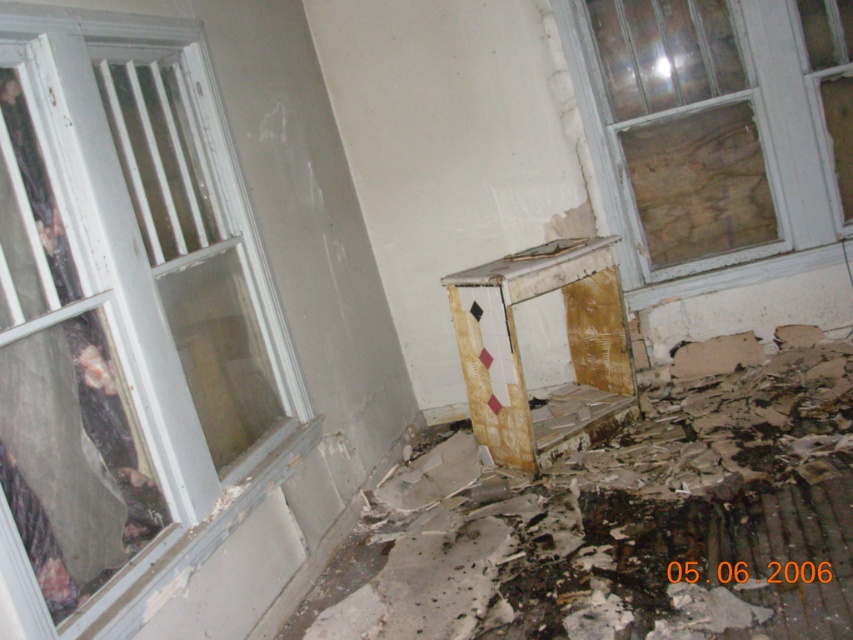
How far apart are white painted wood window at left and transparent glass window at upper right?

The distance of white painted wood window at left from transparent glass window at upper right is 7.62 feet.

Who is more distant from viewer, (138, 506) or (779, 273)?

The point (779, 273) is behind.

This screenshot has height=640, width=853. Identify the location of white painted wood window at left. (131, 317).